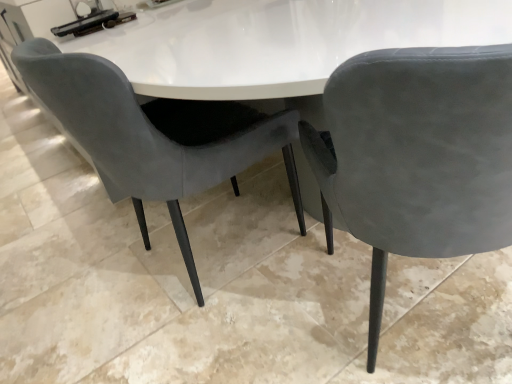
Question: Considering the relative sizes of suede gray chair at center, which is the 2th chair from right to left, and suede gray chair at center, the first chair when ordered from right to left, in the image provided, is suede gray chair at center, which is the 2th chair from right to left, smaller than suede gray chair at center, the first chair when ordered from right to left,?

Choices:
 (A) yes
 (B) no

Answer: (B)

Question: Can you confirm if suede gray chair at center, acting as the 1th chair starting from the left, is shorter than suede gray chair at center, the first chair when ordered from right to left?

Choices:
 (A) yes
 (B) no

Answer: (A)

Question: Does suede gray chair at center, which is the 2th chair from right to left, have a greater width compared to suede gray chair at center, the first chair when ordered from right to left?

Choices:
 (A) yes
 (B) no

Answer: (B)

Question: Does suede gray chair at center, acting as the 1th chair starting from the left, have a lesser width compared to suede gray chair at center, which ranks as the second chair in left-to-right order?

Choices:
 (A) no
 (B) yes

Answer: (B)

Question: From the image's perspective, would you say suede gray chair at center, which is the 2th chair from right to left, is shown under suede gray chair at center, which ranks as the second chair in left-to-right order?

Choices:
 (A) no
 (B) yes

Answer: (A)

Question: Can you confirm if suede gray chair at center, acting as the 1th chair starting from the left, is positioned to the left of suede gray chair at center, the first chair when ordered from right to left?

Choices:
 (A) no
 (B) yes

Answer: (B)

Question: Is the depth of suede gray chair at center, the first chair when ordered from right to left, greater than that of suede gray chair at center, which is the 2th chair from right to left?

Choices:
 (A) yes
 (B) no

Answer: (B)

Question: Is suede gray chair at center, the first chair when ordered from right to left, thinner than suede gray chair at center, which is the 2th chair from right to left?

Choices:
 (A) no
 (B) yes

Answer: (A)

Question: From the image's perspective, is suede gray chair at center, which ranks as the second chair in left-to-right order, on suede gray chair at center, acting as the 1th chair starting from the left?

Choices:
 (A) yes
 (B) no

Answer: (B)

Question: Can you confirm if suede gray chair at center, the first chair when ordered from right to left, is smaller than suede gray chair at center, which is the 2th chair from right to left?

Choices:
 (A) no
 (B) yes

Answer: (B)

Question: Is suede gray chair at center, the first chair when ordered from right to left, outside suede gray chair at center, acting as the 1th chair starting from the left?

Choices:
 (A) no
 (B) yes

Answer: (B)

Question: Does suede gray chair at center, which ranks as the second chair in left-to-right order, have a greater width compared to suede gray chair at center, which is the 2th chair from right to left?

Choices:
 (A) no
 (B) yes

Answer: (B)

Question: From a real-world perspective, is suede gray chair at center, which is the 2th chair from right to left, above or below suede gray chair at center, which ranks as the second chair in left-to-right order?

Choices:
 (A) below
 (B) above

Answer: (B)